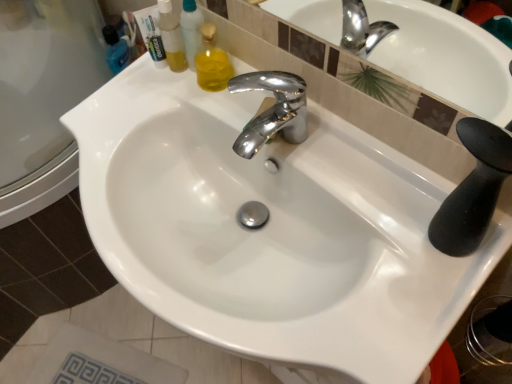
What are the coordinates of `vacant space to the left of translucent plastic bottle at upper left` in the screenshot? It's located at (125, 90).